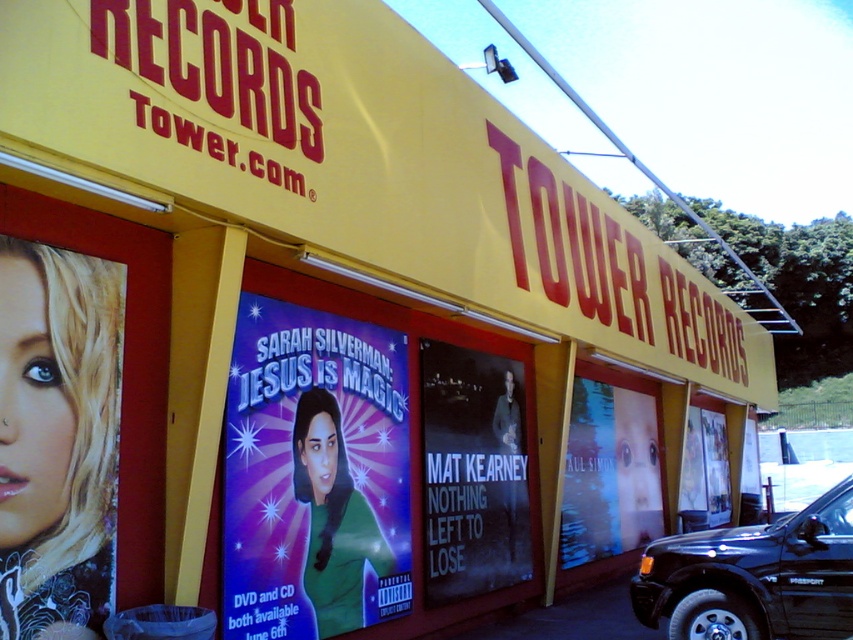
You are designing a new layout for the Tower Records store and need to place a new poster between the purple glossy poster at center and the black matte poster at center. The new poster must be wider than both existing posters. Is this possible given their current widths?

The purple glossy poster at center is wider than the black matte poster at center. Therefore, the new poster must be wider than the purple glossy poster at center to satisfy the requirement. This is possible as long as the new poster exceeds the width of the purple glossy poster at center.

Based on the photo, you are designing a new layout for the Tower Records store and need to know which poster takes up more wall space. Based on the image, which poster between the purple glossy poster at center and the black matte poster at center is larger?

The black matte poster at center is larger because the purple glossy poster at center occupies less space than it.